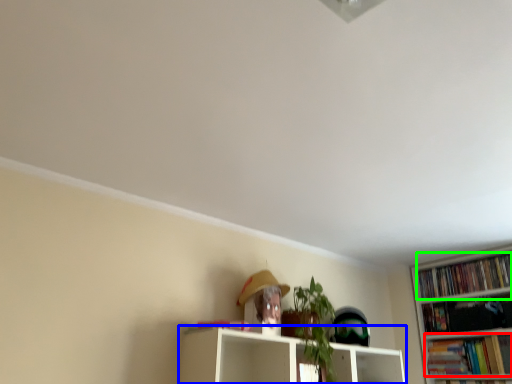
Question: Considering the real-world distances, which object is closest to book (highlighted by a red box)? shelf (highlighted by a blue box) or book (highlighted by a green box).

Choices:
 (A) shelf
 (B) book

Answer: (B)